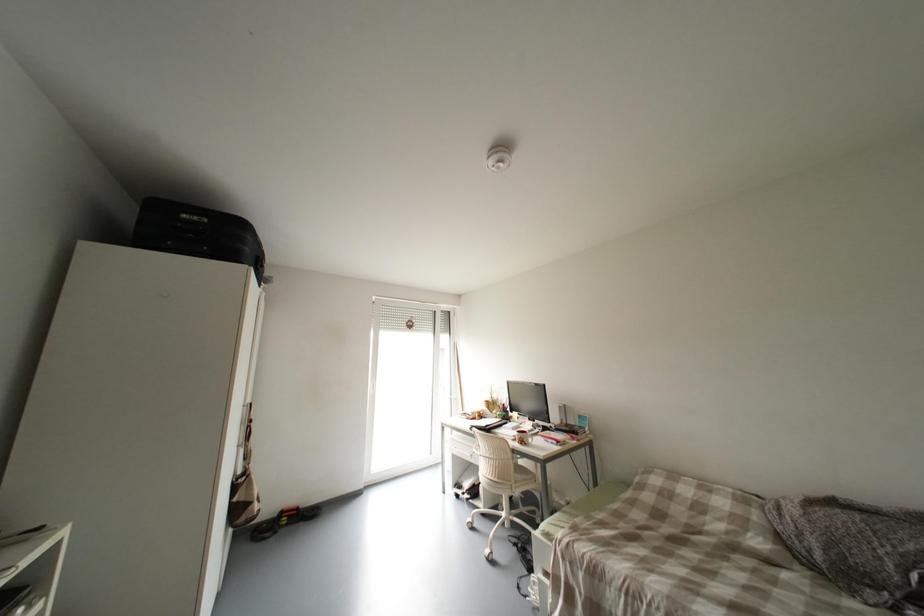
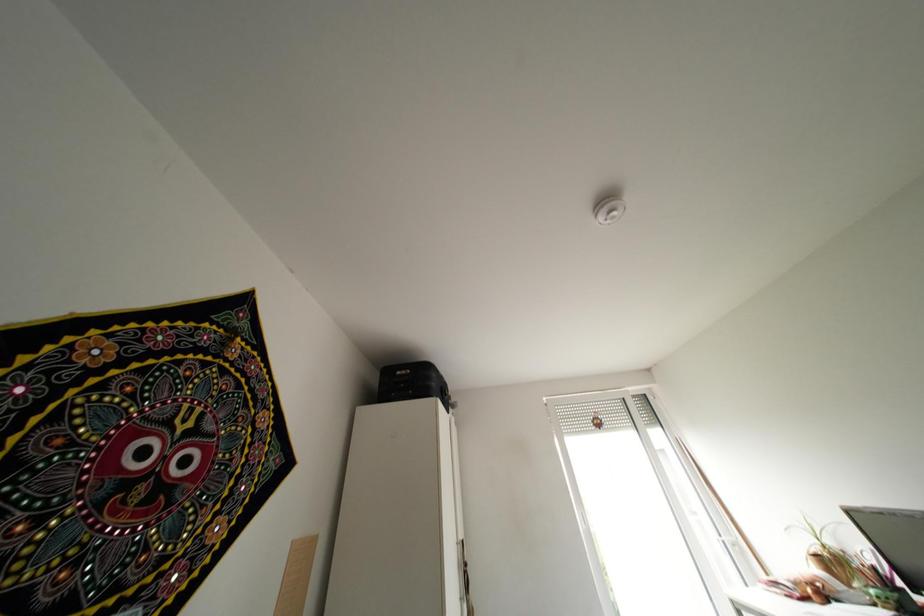
Consider the image. First-person continuous shooting, in which direction is the camera rotating?

The camera's rotation is toward left-up.